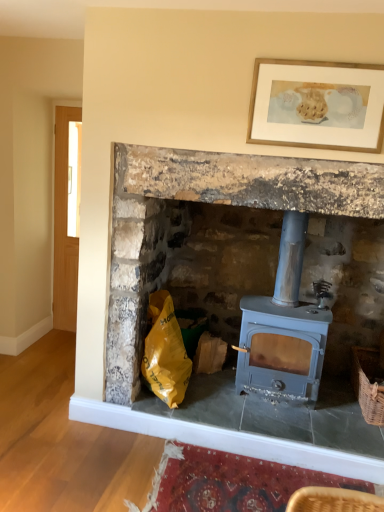
Question: Is the position of matte blue wood burning stove at center less distant than that of wooden-framed artwork at upper center?

Choices:
 (A) no
 (B) yes

Answer: (A)

Question: Does matte blue wood burning stove at center have a lesser height compared to wooden-framed artwork at upper center?

Choices:
 (A) yes
 (B) no

Answer: (B)

Question: Does matte blue wood burning stove at center turn towards wooden-framed artwork at upper center?

Choices:
 (A) no
 (B) yes

Answer: (A)

Question: From the image's perspective, would you say matte blue wood burning stove at center is positioned over wooden-framed artwork at upper center?

Choices:
 (A) no
 (B) yes

Answer: (A)

Question: From the image's perspective, is matte blue wood burning stove at center beneath wooden-framed artwork at upper center?

Choices:
 (A) yes
 (B) no

Answer: (A)

Question: Does point click(x=288, y=370) appear closer or farther from the camera than point click(x=132, y=145)?

Choices:
 (A) closer
 (B) farther

Answer: (B)

Question: Considering the positions of matte blue wood burning stove at center and matte gray wood stove at center in the image, is matte blue wood burning stove at center wider or thinner than matte gray wood stove at center?

Choices:
 (A) thin
 (B) wide

Answer: (A)

Question: From a real-world perspective, is matte blue wood burning stove at center above or below matte gray wood stove at center?

Choices:
 (A) below
 (B) above

Answer: (A)

Question: In the image, is matte blue wood burning stove at center on the left side or the right side of matte gray wood stove at center?

Choices:
 (A) right
 (B) left

Answer: (A)

Question: Considering the positions of matte gray wood stove at center and matte blue wood burning stove at center in the image, is matte gray wood stove at center taller or shorter than matte blue wood burning stove at center?

Choices:
 (A) short
 (B) tall

Answer: (B)

Question: Is matte gray wood stove at center spatially inside matte blue wood burning stove at center, or outside of it?

Choices:
 (A) outside
 (B) inside

Answer: (A)

Question: From the image's perspective, is matte gray wood stove at center located above or below matte blue wood burning stove at center?

Choices:
 (A) above
 (B) below

Answer: (A)

Question: Does point (301, 445) appear closer or farther from the camera than point (294, 287)?

Choices:
 (A) farther
 (B) closer

Answer: (B)

Question: From their relative heights in the image, would you say matte gray wood stove at center is taller or shorter than woven brown basket at lower right?

Choices:
 (A) short
 (B) tall

Answer: (B)

Question: Considering the positions of matte gray wood stove at center and woven brown basket at lower right in the image, is matte gray wood stove at center wider or thinner than woven brown basket at lower right?

Choices:
 (A) thin
 (B) wide

Answer: (B)